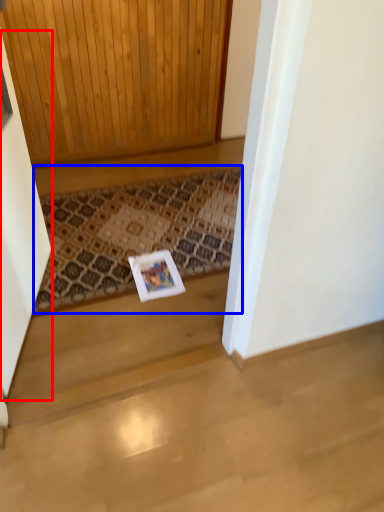
Question: Among these objects, which one is farthest to the camera, screen door (highlighted by a red box) or doormat (highlighted by a blue box)?

Choices:
 (A) screen door
 (B) doormat

Answer: (B)